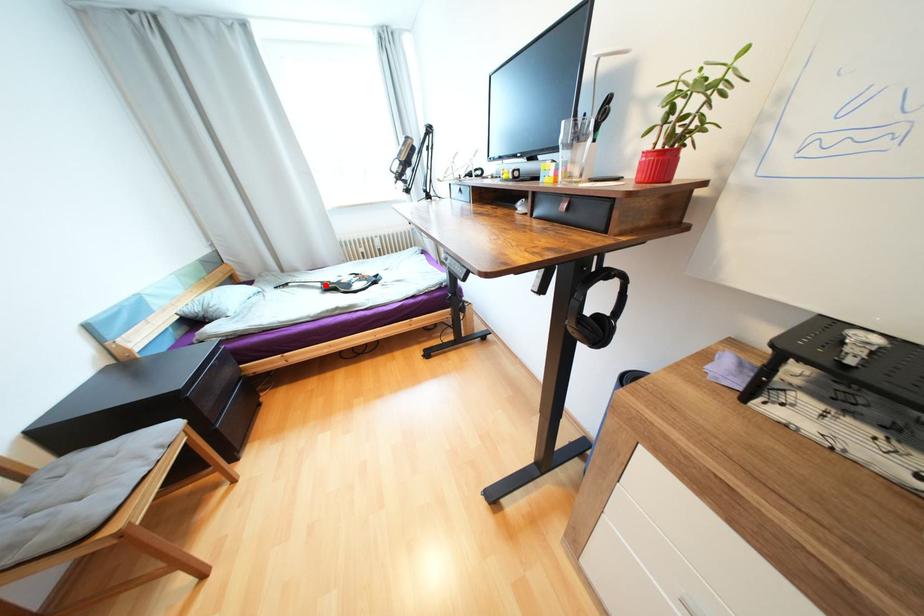
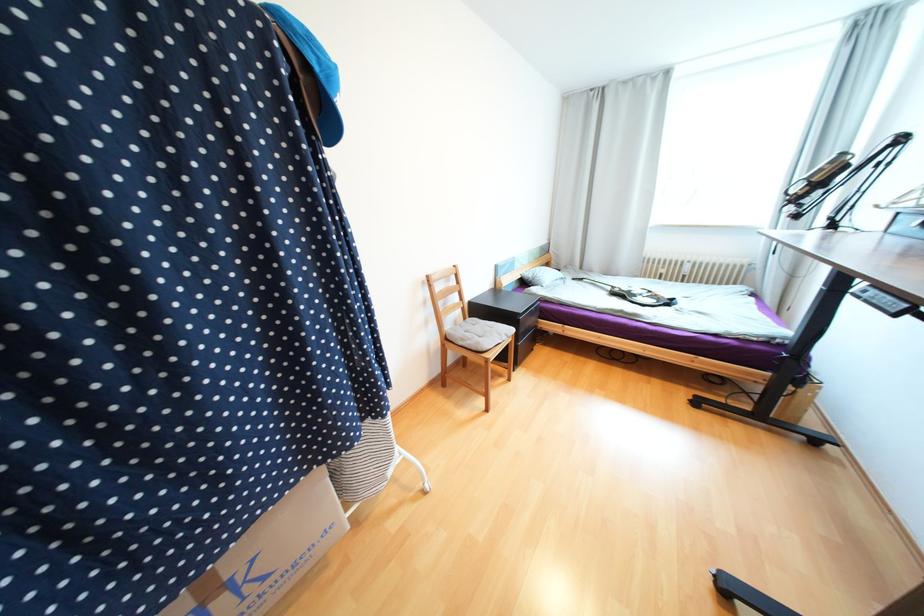
Question: I am providing you with two images of the same scene from different viewpoints. A red point is shown in image1. For the corresponding object point in image2, is it positioned nearer or farther from the camera?

Choices:
 (A) Nearer
 (B) Farther

Answer: (B)